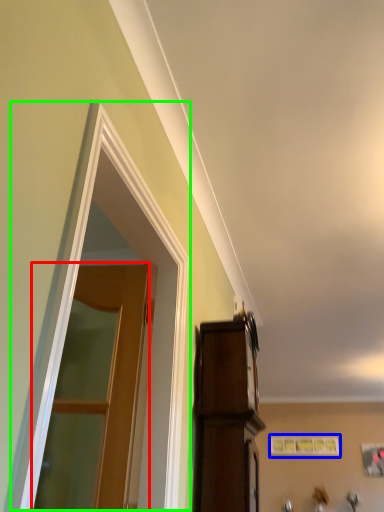
Question: Based on their relative distances, which object is farther from door (highlighted by a red box)? Choose from picture frame (highlighted by a blue box) and window (highlighted by a green box).

Choices:
 (A) picture frame
 (B) window

Answer: (A)